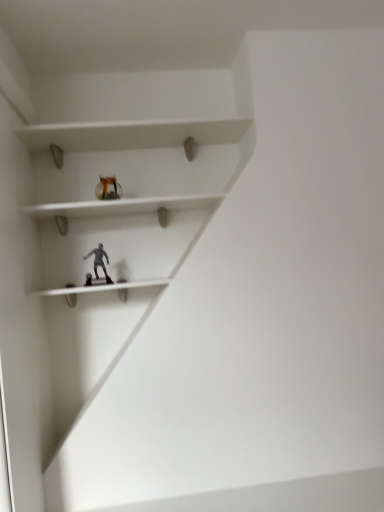
Question: Is satin silver figurine at center touching translucent glass vase at upper center?

Choices:
 (A) yes
 (B) no

Answer: (B)

Question: Considering the relative sizes of satin silver figurine at center and translucent glass vase at upper center in the image provided, is satin silver figurine at center smaller than translucent glass vase at upper center?

Choices:
 (A) no
 (B) yes

Answer: (A)

Question: Is satin silver figurine at center taller than translucent glass vase at upper center?

Choices:
 (A) yes
 (B) no

Answer: (B)

Question: Is satin silver figurine at center positioned with its back to translucent glass vase at upper center?

Choices:
 (A) yes
 (B) no

Answer: (B)

Question: Is satin silver figurine at center to the right of translucent glass vase at upper center from the viewer's perspective?

Choices:
 (A) yes
 (B) no

Answer: (B)

Question: From the image's perspective, is satin silver figurine at center on translucent glass vase at upper center?

Choices:
 (A) no
 (B) yes

Answer: (A)

Question: Is translucent glass vase at upper center far from satin silver figurine at center?

Choices:
 (A) no
 (B) yes

Answer: (A)

Question: Could you tell me if translucent glass vase at upper center is facing satin silver figurine at center?

Choices:
 (A) yes
 (B) no

Answer: (B)

Question: From a real-world perspective, does translucent glass vase at upper center stand above satin silver figurine at center?

Choices:
 (A) yes
 (B) no

Answer: (A)

Question: Does translucent glass vase at upper center lie in front of satin silver figurine at center?

Choices:
 (A) no
 (B) yes

Answer: (A)

Question: Is translucent glass vase at upper center wider than satin silver figurine at center?

Choices:
 (A) yes
 (B) no

Answer: (B)

Question: Is translucent glass vase at upper center bigger than satin silver figurine at center?

Choices:
 (A) no
 (B) yes

Answer: (A)

Question: From the image's perspective, is translucent glass vase at upper center positioned above or below satin silver figurine at center?

Choices:
 (A) above
 (B) below

Answer: (A)